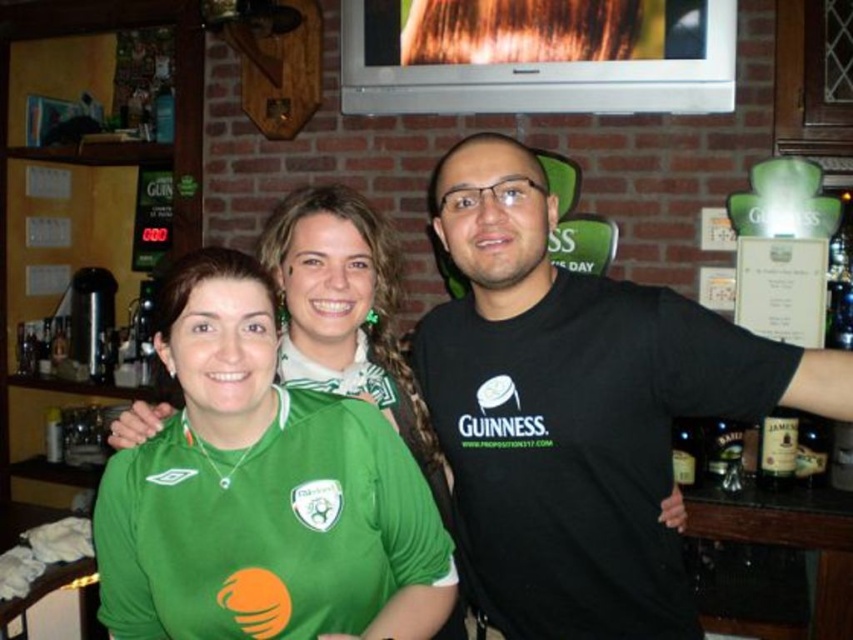
Who is positioned more to the left, green jersey at center or brown glass bottle at right?

green jersey at center

Between green jersey at center and brown glass bottle at right, which one appears on the right side from the viewer's perspective?

brown glass bottle at right

Does point (368, 376) come farther from viewer compared to point (772, 460)?

That is False.

The width and height of the screenshot is (853, 640). I want to click on green jersey at center, so click(347, 308).

Between black matte t-shirt at center and green jersey at center, which one is positioned higher?

Positioned higher is green jersey at center.

Does black matte t-shirt at center have a lesser height compared to green jersey at center?

No, black matte t-shirt at center is not shorter than green jersey at center.

Who is more distant from viewer, (x=619, y=452) or (x=347, y=205)?

Point (x=347, y=205)

I want to click on black matte t-shirt at center, so click(x=576, y=408).

Is point (640, 483) positioned in front of point (759, 440)?

Yes.

Can you confirm if black matte t-shirt at center is positioned to the left of brown glass bottle at right?

Indeed, black matte t-shirt at center is positioned on the left side of brown glass bottle at right.

Locate an element on the screen. The height and width of the screenshot is (640, 853). black matte t-shirt at center is located at coordinates (576, 408).